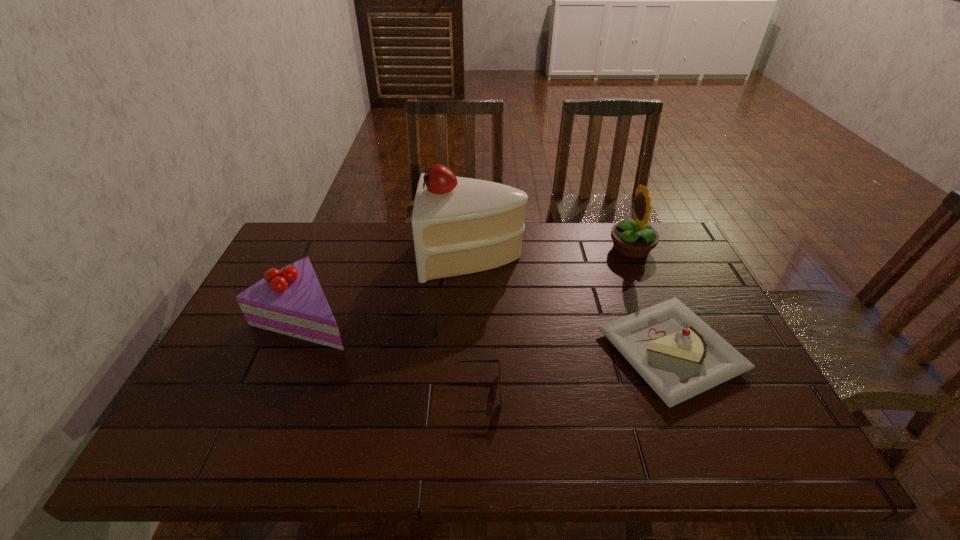
Locate an element on the screen. The height and width of the screenshot is (540, 960). free spot between the shortest cake and the second cake from left to right is located at coordinates [572, 303].

The height and width of the screenshot is (540, 960). I want to click on vacant region between the second tallest cake and the shortest cake, so click(x=488, y=333).

The height and width of the screenshot is (540, 960). Identify the location of free space between the sunflower and the second cake from left to right. (552, 252).

Identify the location of free spot between the shortest object and the second shortest object. point(574,372).

Image resolution: width=960 pixels, height=540 pixels. I want to click on vacant area between the shortest object and the fourth tallest object, so click(574, 372).

This screenshot has width=960, height=540. Identify the location of free space between the fourth shortest object and the second cake from left to right. (552, 252).

You are a GUI agent. You are given a task and a screenshot of the screen. Output one action in this format:
    pyautogui.click(x=<x>, y=<y>)
    Task: Click on the vacant area between the shortest cake and the shortest object
    
    Given the screenshot: What is the action you would take?
    pyautogui.click(x=574, y=372)

Locate an element on the screen. The height and width of the screenshot is (540, 960). vacant space that's between the tallest cake and the fourth shortest object is located at coordinates (552, 252).

Image resolution: width=960 pixels, height=540 pixels. I want to click on the third closest object relative to the fourth shortest object, so click(x=473, y=361).

Where is `object that ranks as the third closest to the fourth shortest object`? The width and height of the screenshot is (960, 540). object that ranks as the third closest to the fourth shortest object is located at coordinates pos(473,361).